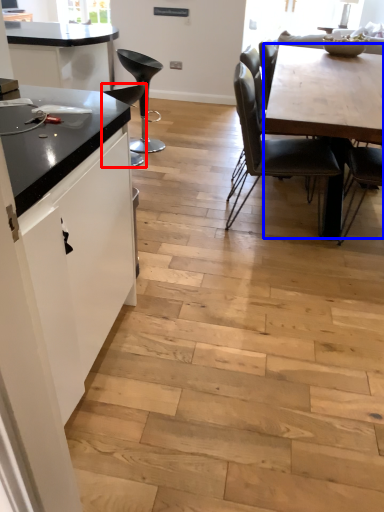
Question: Among these objects, which one is farthest to the camera, chair (highlighted by a red box) or table (highlighted by a blue box)?

Choices:
 (A) chair
 (B) table

Answer: (A)